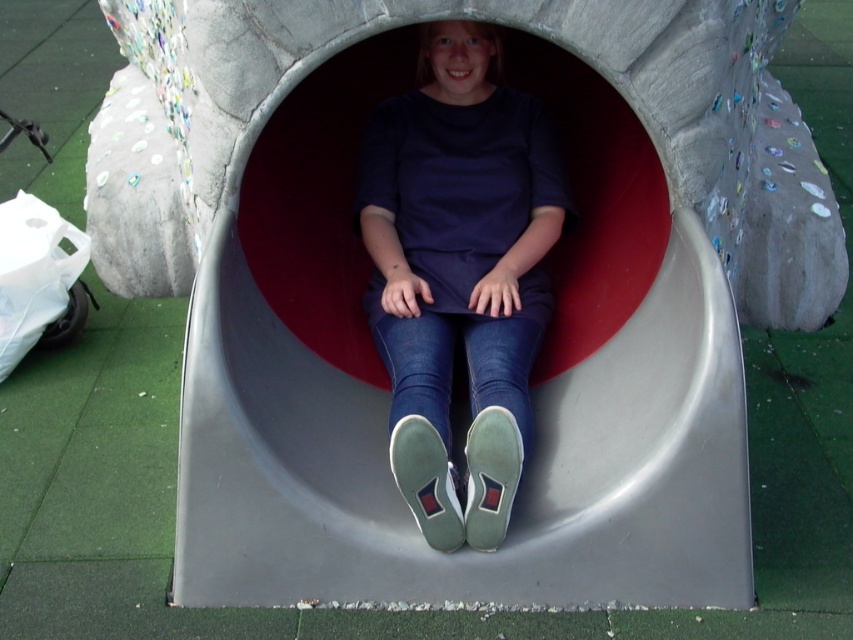
Is smooth plastic slide at center above matte blue jeans at center?

No.

Does smooth plastic slide at center have a lesser height compared to matte blue jeans at center?

Correct, smooth plastic slide at center is not as tall as matte blue jeans at center.

Is point (671, 518) positioned in front of point (505, 499)?

No.

You are a GUI agent. You are given a task and a screenshot of the screen. Output one action in this format:
    pyautogui.click(x=<x>, y=<y>)
    Task: Click on the smooth plastic slide at center
    
    Given the screenshot: What is the action you would take?
    pyautogui.click(x=521, y=481)